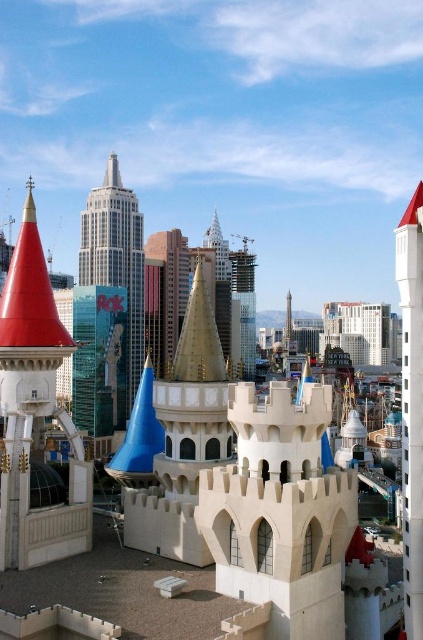
You are a drone operator trying to navigate between the white concrete tower at right and the white glass skyscraper at center. Based on their positions, which structure is closer to the ground?

The white concrete tower at right is positioned under the white glass skyscraper at center, so the white concrete tower at right is closer to the ground.